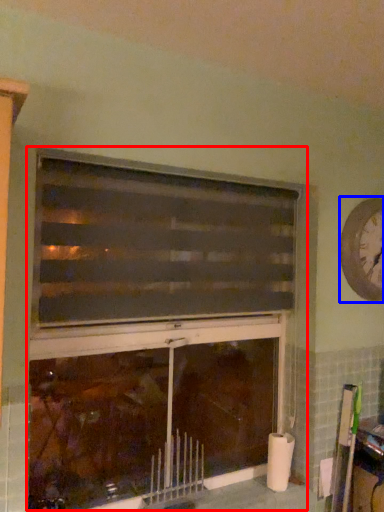
Question: Which object is further to the camera taking this photo, fireplace (highlighted by a red box) or clock (highlighted by a blue box)?

Choices:
 (A) fireplace
 (B) clock

Answer: (B)